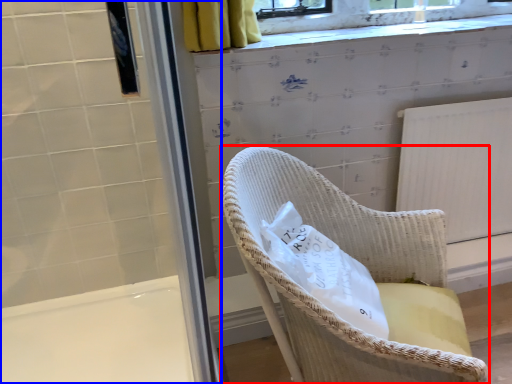
Question: Among these objects, which one is nearest to the camera, chair (highlighted by a red box) or screen door (highlighted by a blue box)?

Choices:
 (A) chair
 (B) screen door

Answer: (A)